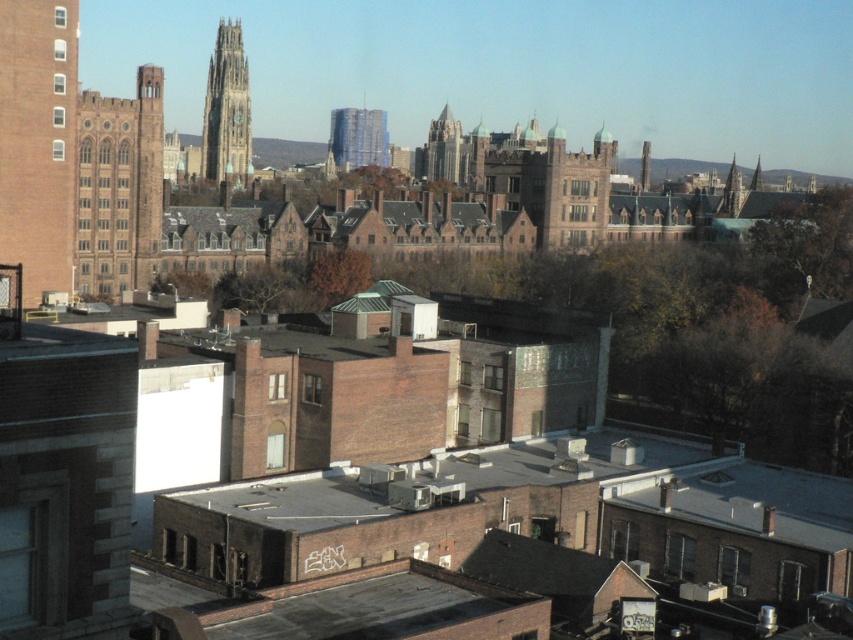
You are standing in the urban landscape and want to walk from the point at coordinates (30, 1) to the point at coordinates (86, 168). Since you can only move forward, will you pass in front of or behind the historic buildings?

Since point (30, 1) is in front of point (86, 168), you will pass in front of the historic buildings when moving from the starting point to the destination.

You are a photographer planning to capture a sunset shot of the brick tower at left and the gold stone tower at upper left. Based on the scene, which tower should you position to the right side in your photo?

The brick tower at left should be positioned to the right side in your photo because it is already on the right side of the gold stone tower at upper left according to the description.

You are standing in the urban landscape described. There is a gold stone tower at upper left located at point (227, 109). If you want to take a photo of the gold stone tower at upper left, where should you position yourself relative to the other buildings?

The gold stone tower at upper left is located at point (227, 109), so you should position yourself in an area where this coordinate is visible, likely towards the lower right to capture the tower at the upper left corner of your frame.